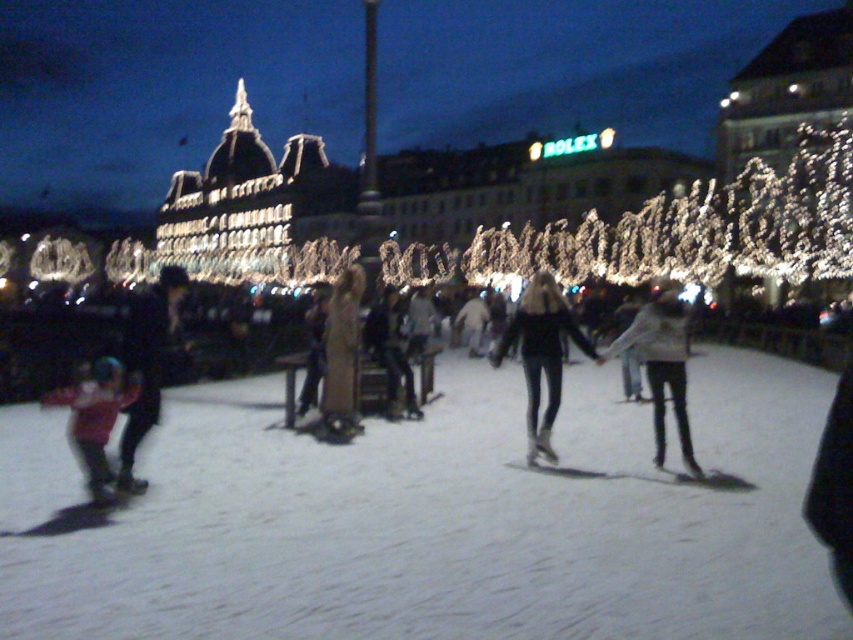
Question: Where is white smooth ice at center located in relation to dark blue jeans at lower left in the image?

Choices:
 (A) left
 (B) right

Answer: (B)

Question: Is black matte jacket at center to the right of brown leather jacket at center from the viewer's perspective?

Choices:
 (A) no
 (B) yes

Answer: (B)

Question: Which point appears farthest from the camera in this image?

Choices:
 (A) click(x=326, y=355)
 (B) click(x=518, y=307)
 (C) click(x=677, y=339)

Answer: (B)

Question: Among these objects, which one is farthest from the camera?

Choices:
 (A) black matte jacket at center
 (B) matte pink jacket at lower left

Answer: (A)

Question: Is white fuzzy jacket at center below matte pink jacket at lower left?

Choices:
 (A) no
 (B) yes

Answer: (A)

Question: Which is nearer to the white fuzzy jacket at center?

Choices:
 (A) matte pink jacket at lower left
 (B) brown leather jacket at center

Answer: (B)